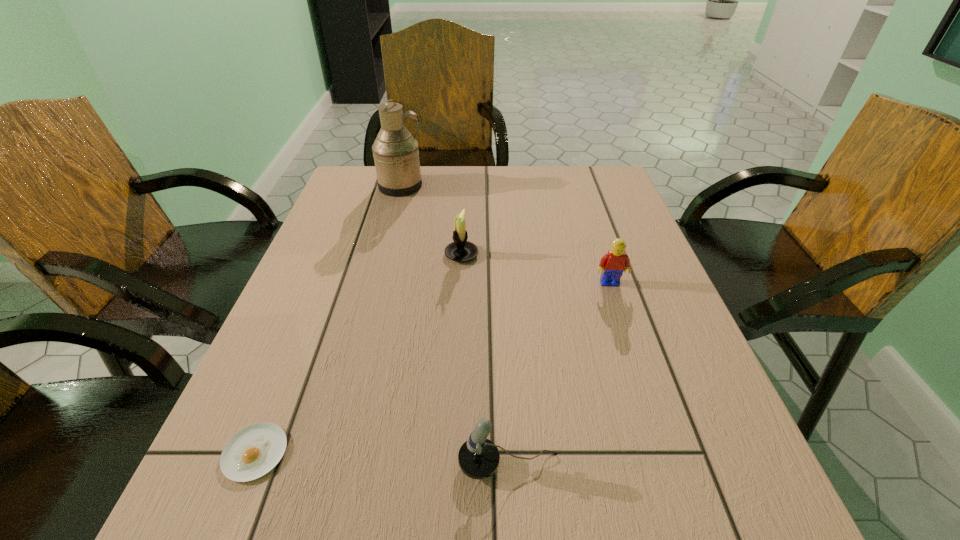
Image resolution: width=960 pixels, height=540 pixels. Find the location of `the farthest object`. the farthest object is located at coordinates (396, 156).

Find the location of `the tallest object`. the tallest object is located at coordinates (396, 156).

You are a GUI agent. You are given a task and a screenshot of the screen. Output one action in this format:
    pyautogui.click(x=<x>, y=<y>)
    Task: Click on the candle holder
    
    Given the screenshot: What is the action you would take?
    pyautogui.click(x=461, y=250)

Where is `the third nearest object`? Image resolution: width=960 pixels, height=540 pixels. the third nearest object is located at coordinates (613, 264).

What are the coordinates of `the rightmost object` in the screenshot? It's located at (613, 264).

Find the location of a particular element. This screenshot has width=960, height=540. microphone is located at coordinates (478, 458).

Find the location of `the shortest object`. the shortest object is located at coordinates (251, 453).

What are the coordinates of `free space located 0.190m on the front of the farthest object` in the screenshot? It's located at (388, 237).

Locate an element on the screen. The height and width of the screenshot is (540, 960). vacant space located on the left of the second farthest object is located at coordinates (416, 254).

You are a GUI agent. You are given a task and a screenshot of the screen. Output one action in this format:
    pyautogui.click(x=<x>, y=<y>)
    Task: Click on the vacant space situated 0.140m on the front-facing side of the third farthest object
    Image resolution: width=960 pixels, height=540 pixels.
    Given the screenshot: What is the action you would take?
    pyautogui.click(x=627, y=335)